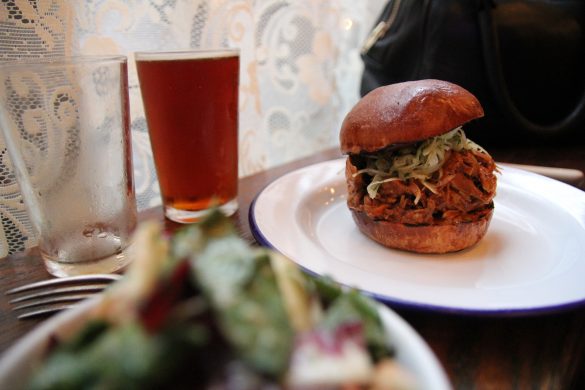
Locate an element on the screen. prongs of fork is located at coordinates (53, 292), (58, 299), (42, 312), (37, 283).